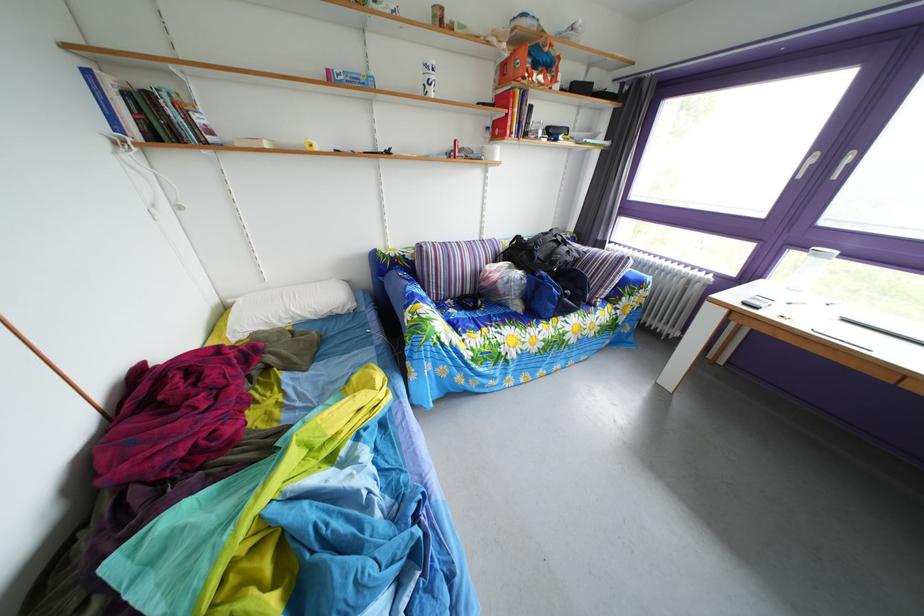
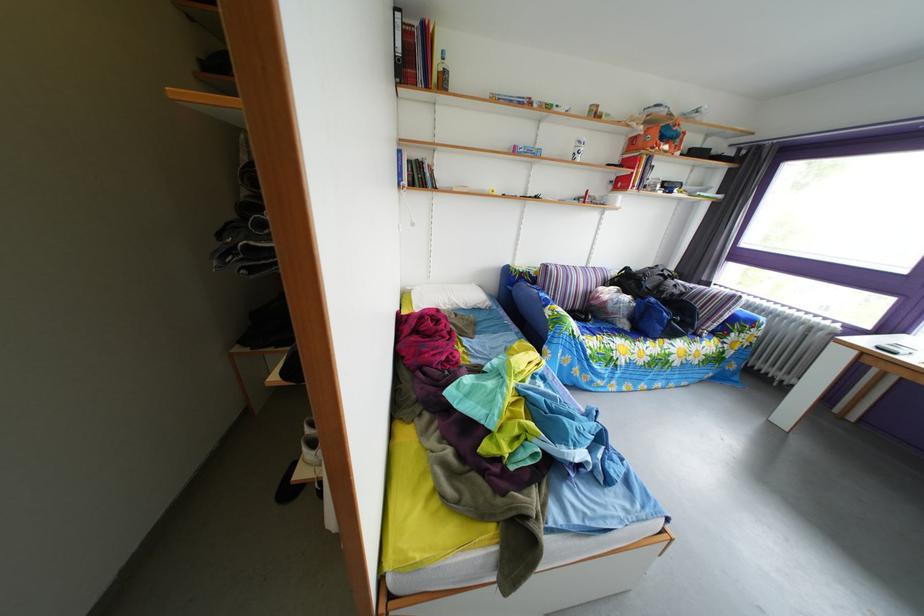
Locate, in the second image, the point that corresponds to the point at 545,74 in the first image.

(673, 147)